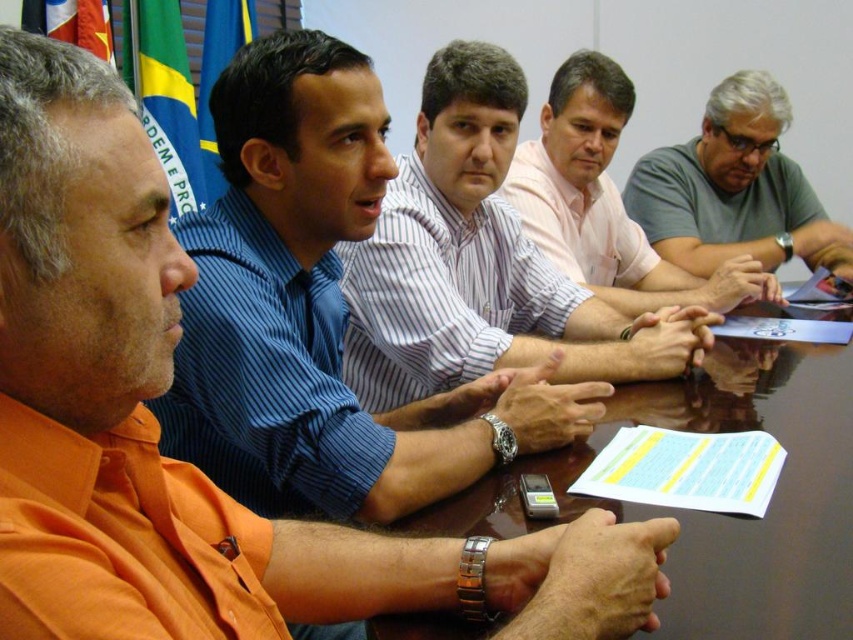
Consider the image. You are a photographer setting up for a group photo. You need to position a microphone stand between the white striped shirt at center and the gray matte shirt at upper right. Which side of the microphone stand should face the taller object?

The white striped shirt at center is taller than the gray matte shirt at upper right, so the microphone stand should be positioned with its open side facing the white striped shirt at center to accommodate its height.

You are a photographer taking a picture of the white striped shirt at center and the gray matte shirt at upper right. Which one should you focus on to ensure it is in the foreground of the photo?

The white striped shirt at center should be focused on to ensure it is in the foreground because it is positioned in front of the gray matte shirt at upper right.